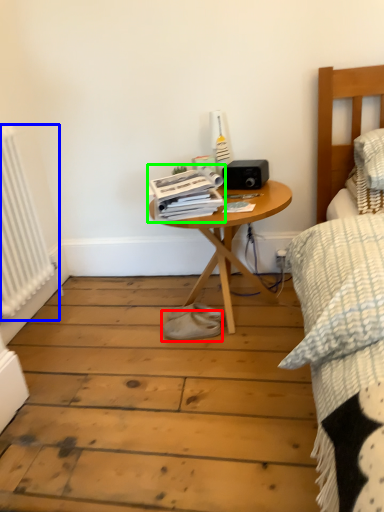
Question: Considering the real-world distances, which object is farthest from footwear (highlighted by a red box)? radiator (highlighted by a blue box) or magazine (highlighted by a green box)?

Choices:
 (A) radiator
 (B) magazine

Answer: (A)